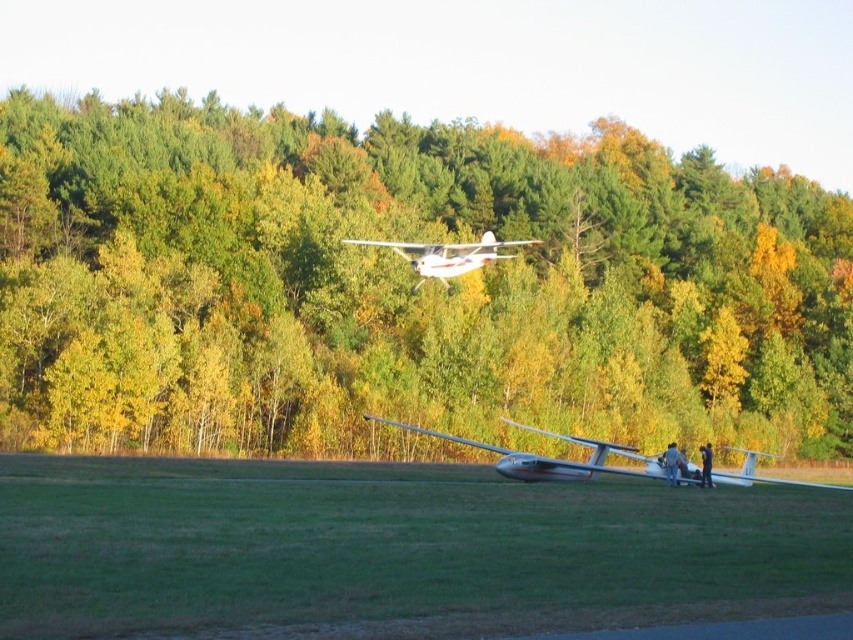
What are the coordinates of the green matte trees at upper center in the image?

The green matte trees at upper center are located at coordinates point (403, 285).

You are a pilot planning to take off from the airfield. You notice the green matte trees at upper center and the silver metallic glider at lower center. Which object is wider in the image?

The green matte trees at upper center might be wider than silver metallic glider at lower center according to the description.